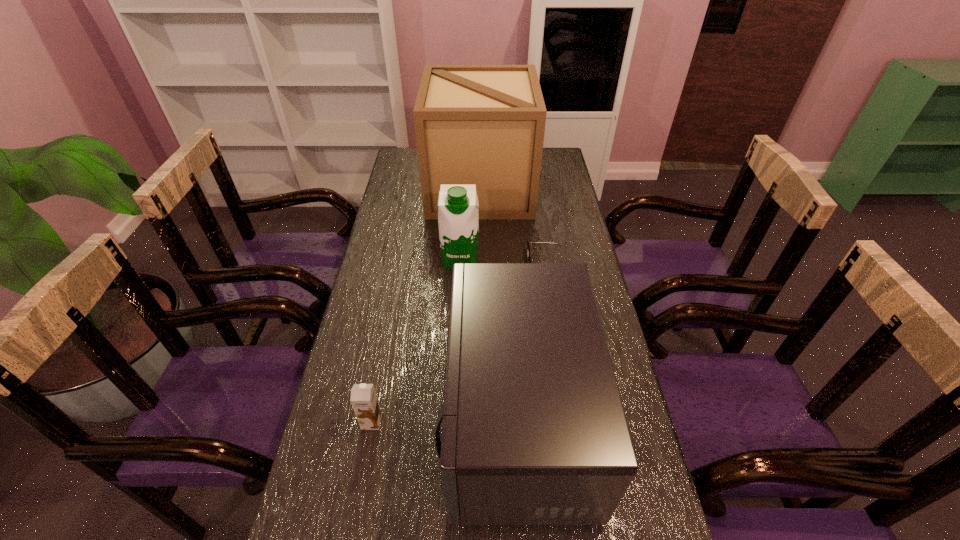
Where is `free point located 0.220m on the front-facing side of the microwave oven`? free point located 0.220m on the front-facing side of the microwave oven is located at coordinates (353, 418).

Identify the location of vacant space situated 0.250m on the front-facing side of the microwave oven. (341, 418).

The height and width of the screenshot is (540, 960). Find the location of `vacant space located 0.230m on the right of the leftmost object`. vacant space located 0.230m on the right of the leftmost object is located at coordinates (476, 421).

Identify the location of vacant area situated 0.220m on the front-facing side of the shortest object. This screenshot has width=960, height=540. (461, 265).

What are the coordinates of `vacant area located 0.100m on the front-facing side of the shortest object` in the screenshot? It's located at (497, 265).

You are a GUI agent. You are given a task and a screenshot of the screen. Output one action in this format:
    pyautogui.click(x=<x>, y=<y>)
    Task: Click on the free region located on the front-facing side of the shortest object
    The height and width of the screenshot is (540, 960).
    Given the screenshot: What is the action you would take?
    pyautogui.click(x=479, y=265)

Locate an element on the screen. Image resolution: width=960 pixels, height=540 pixels. object at the far edge is located at coordinates (483, 125).

Identify the location of box that is at the left edge. The width and height of the screenshot is (960, 540). (483, 125).

Where is `chocolate milk present at the left edge`? chocolate milk present at the left edge is located at coordinates (364, 400).

Find the location of a particular element. The image size is (960, 540). box located at the right edge is located at coordinates (483, 125).